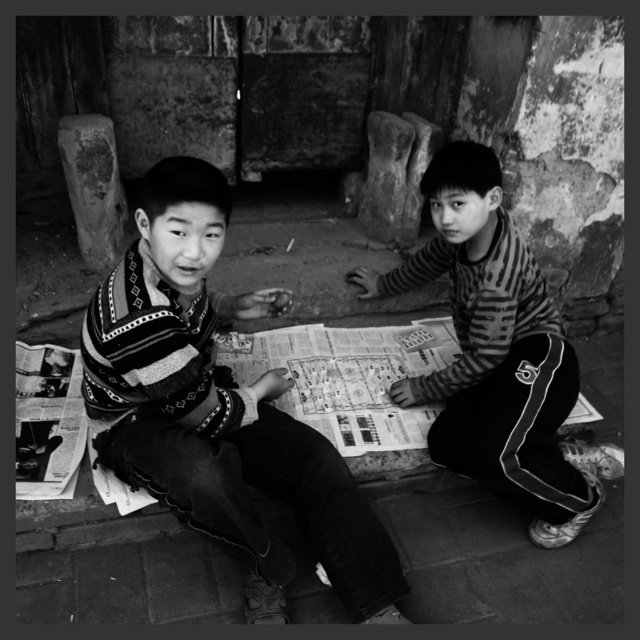
Question: Which object is positioned farthest from the printed paper game at center?

Choices:
 (A) striped fabric shirt at center
 (B) striped sweater at center

Answer: (B)

Question: Is striped sweater at center to the right of striped fabric shirt at center from the viewer's perspective?

Choices:
 (A) no
 (B) yes

Answer: (A)

Question: Which point is closer to the camera taking this photo?

Choices:
 (A) (476, 368)
 (B) (252, 364)

Answer: (A)

Question: Is striped sweater at center above striped fabric shirt at center?

Choices:
 (A) no
 (B) yes

Answer: (A)

Question: Is striped sweater at center wider than striped fabric shirt at center?

Choices:
 (A) yes
 (B) no

Answer: (B)

Question: Which point is closer to the camera taking this photo?

Choices:
 (A) tap(124, 420)
 (B) tap(461, 378)

Answer: (A)